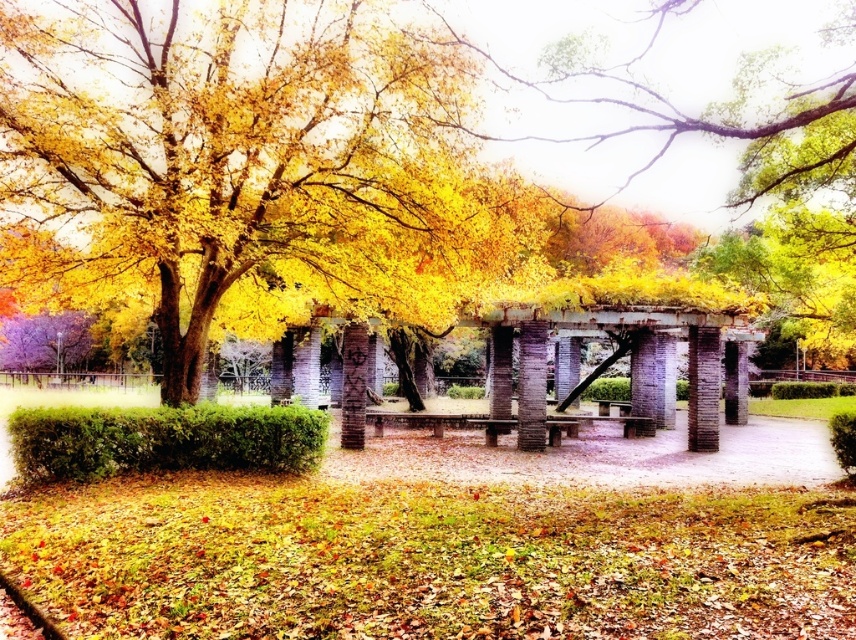
Consider the image. You are standing at the center of the park and see two points marked in the image. The first point is at coordinates point (197, 426) and the second point is at coordinates point (360, 369). Which point is closer to you?

Point (197, 426) is in front of point (360, 369), so it is closer to you.

You are a photographer wanting to capture the smooth concrete bench at center and the yellow leaves at center in a single frame. Based on their positions, which object appears larger in the photo?

The yellow leaves at center appears larger in the photo because they are taller than the smooth concrete bench at center.

You are standing in the autumnal park scene. There is a point marked at coordinates (245, 161). What object is located at this point?

The yellow leaves at center are located at point (245, 161).